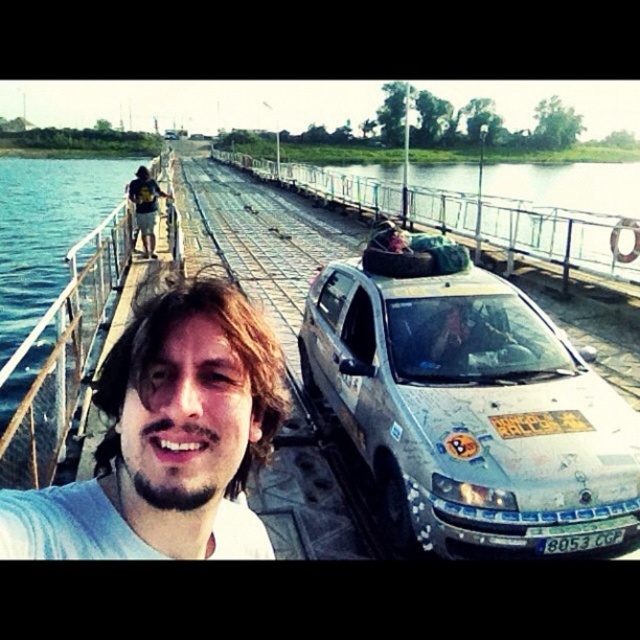
You are a pedestrian standing on the bridge and see a white car parked ahead. You notice two features on the car at the center of the image. Which one is closer to you between the light brown hair at center and the white plastic license plate at center?

The light brown hair at center is closer to the viewer than the white plastic license plate at center.

You are a pedestrian standing on the bridge and see the silver metallic car at center and the light brown hair at center. Which object is closer to you?

The silver metallic car at center is 11.11 feet away from light brown hair at center. Therefore, the light brown hair at center is closer to you than the silver metallic car at center.

You are a delivery driver who needs to park your 12 feet long truck on this bridge. The bridge has a narrow surface with a silver metallic car at center and a white plastic license plate at center. Can you safely park your truck without overlapping any existing objects on the bridge?

The silver metallic car at center and white plastic license plate at center are 4.41 feet apart from each other. Since the truck is 12 feet long, it would require more space than the available gap between these objects. Therefore, you cannot safely park your truck without overlapping existing objects on the bridge.